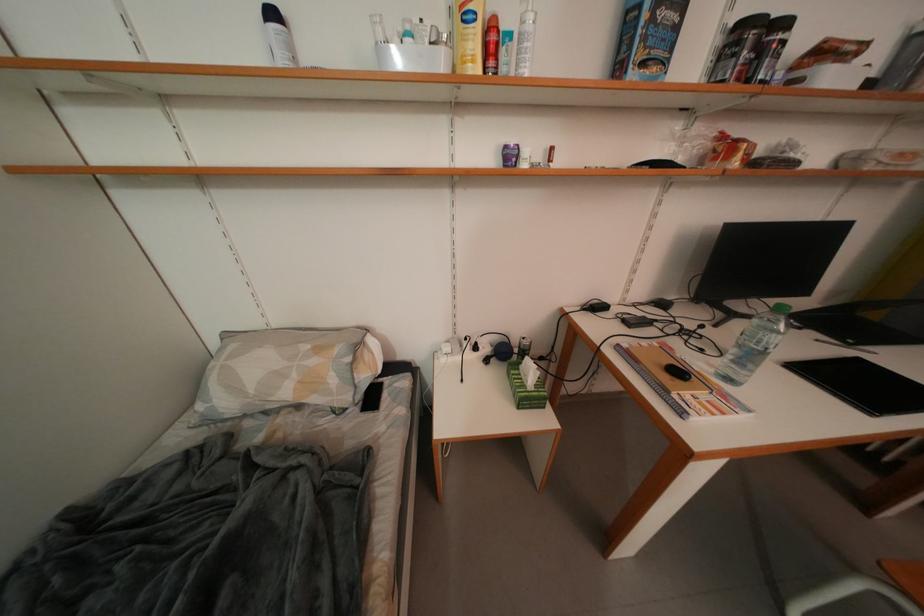
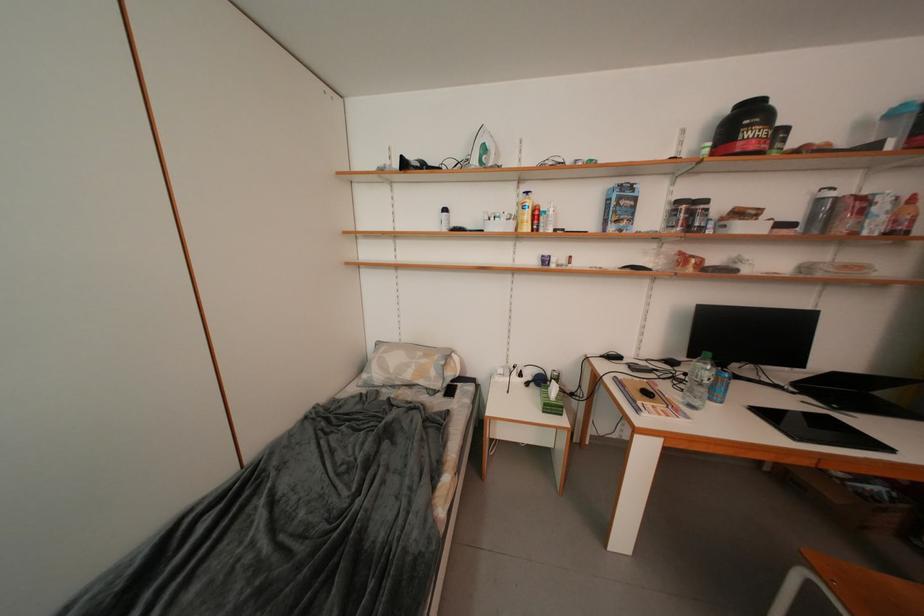
Question: The camera is either moving clockwise (left) or counter-clockwise (right) around the object. The first image is from the beginning of the video and the second image is from the end. Is the camera moving left or right when shooting the video?

Choices:
 (A) Left
 (B) Right

Answer: (B)